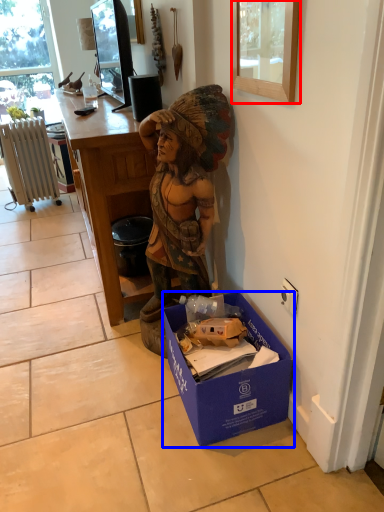
Question: Which point is closer to the camera, picture frame (highlighted by a red box) or box (highlighted by a blue box)?

Choices:
 (A) picture frame
 (B) box

Answer: (A)